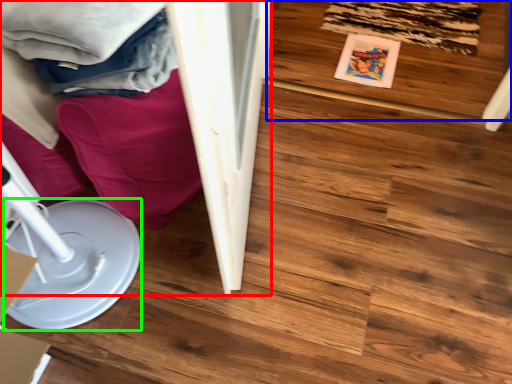
Question: Which is nearer to the furniture (highlighted by a red box)? wood (highlighted by a blue box) or paper plate (highlighted by a green box).

Choices:
 (A) wood
 (B) paper plate

Answer: (B)